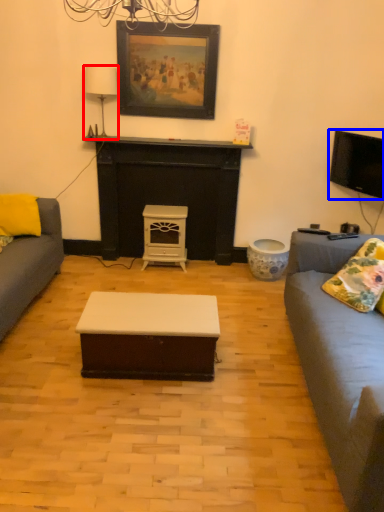
Question: Which object is further to the camera taking this photo, lamp (highlighted by a red box) or television (highlighted by a blue box)?

Choices:
 (A) lamp
 (B) television

Answer: (A)